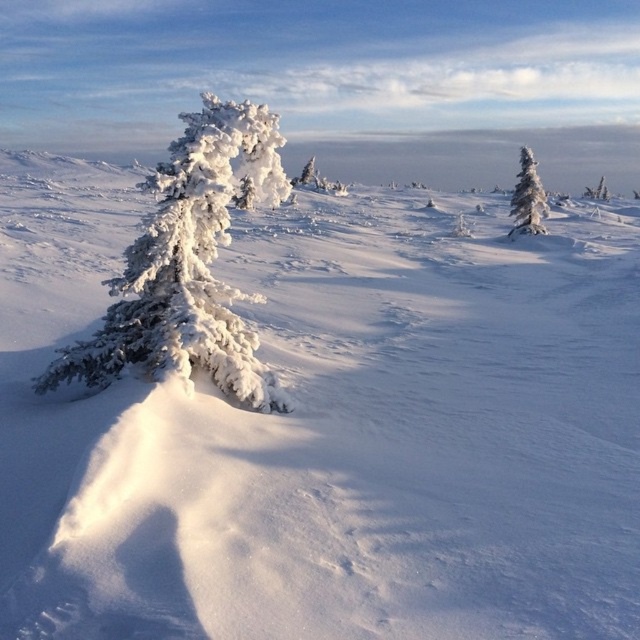
What do you see at coordinates (182, 273) in the screenshot?
I see `white frosty tree at center` at bounding box center [182, 273].

Is white frosty tree at center smaller than white frosty tree at right?

Indeed, white frosty tree at center has a smaller size compared to white frosty tree at right.

Does point (100, 356) come in front of point (516, 179)?

That is True.

At what (x,y) coordinates should I click in order to perform the action: click on white frosty tree at center. Please return your answer as a coordinate pair (x, y). Looking at the image, I should click on 182,273.